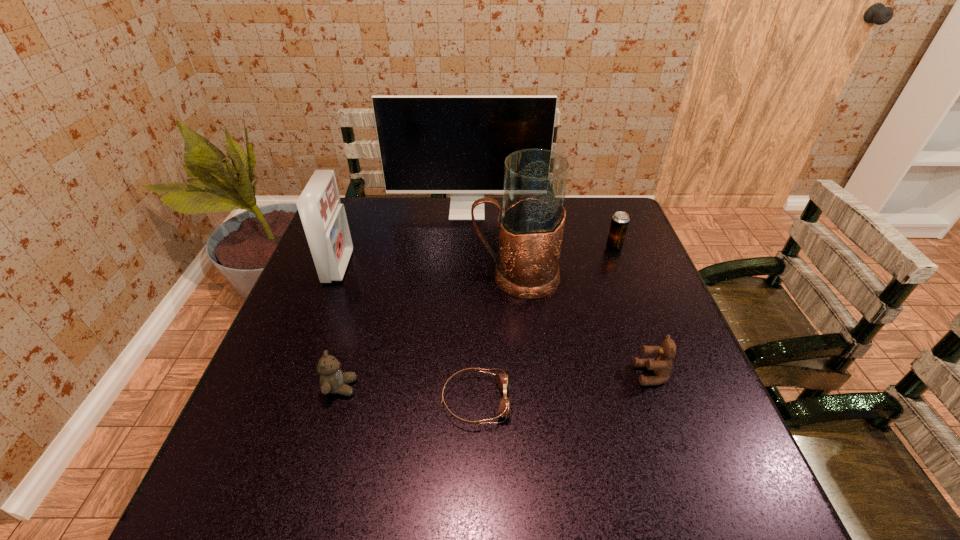
This screenshot has width=960, height=540. I want to click on vacant region located with the handle on the side of the pitcher, so click(x=396, y=276).

Identify the location of vacant area situated 0.070m with the handle on the side of the pitcher. Image resolution: width=960 pixels, height=540 pixels. (446, 276).

Identify the location of free spot located 0.350m on the front-facing side of the fifth shortest object. (471, 266).

Identify the location of vacant region located 0.310m on the front of the beer can. (645, 332).

This screenshot has height=540, width=960. I want to click on vacant region located on the face of the right teddy bear, so click(x=567, y=374).

Identify the location of blank space located on the face of the right teddy bear. The height and width of the screenshot is (540, 960). (544, 374).

Find the location of `blank space located 0.260m on the face of the right teddy bear`. blank space located 0.260m on the face of the right teddy bear is located at coordinates (517, 374).

Find the location of a particular element. The image size is (960, 540). blank space located 0.330m on the face of the left teddy bear is located at coordinates (511, 387).

Where is `vacant space located through the lenses of the goggles`? vacant space located through the lenses of the goggles is located at coordinates (614, 401).

What are the coordinates of `object that is at the far edge` in the screenshot? It's located at (428, 144).